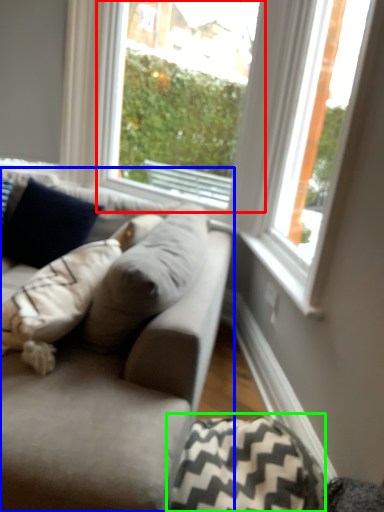
Question: Estimate the real-world distances between objects in this image. Which object is closer to window (highlighted by a red box), studio couch (highlighted by a blue box) or pillow (highlighted by a green box)?

Choices:
 (A) studio couch
 (B) pillow

Answer: (A)